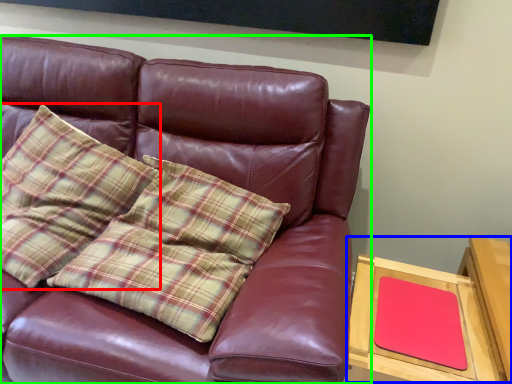
Question: Based on their relative distances, which object is farther from pillow (highlighted by a red box)? Choose from table (highlighted by a blue box) and studio couch (highlighted by a green box).

Choices:
 (A) table
 (B) studio couch

Answer: (A)